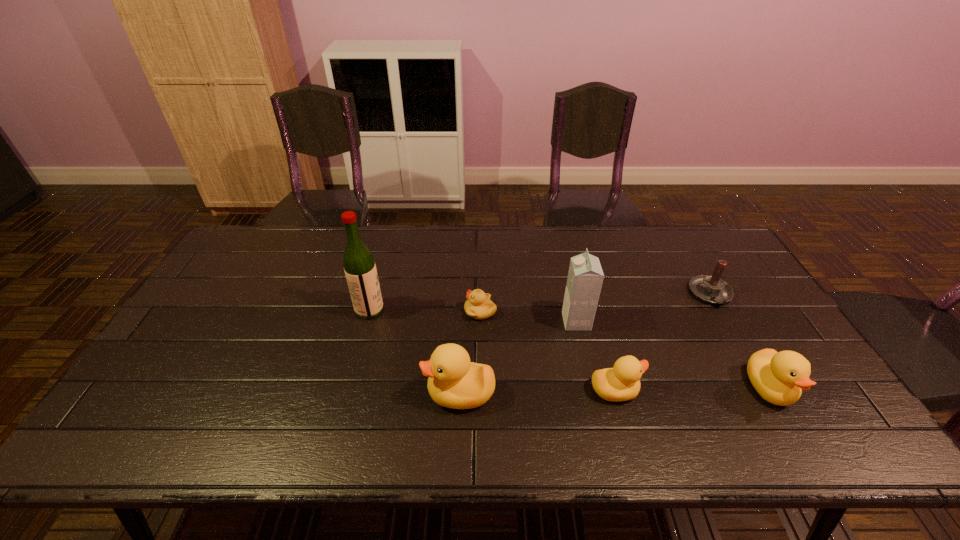
Image resolution: width=960 pixels, height=540 pixels. I want to click on vacant space situated 0.160m on the side of the candle with the handle loop, so click(x=744, y=354).

Where is `vacant space located on the front label of the second tallest object`? This screenshot has width=960, height=540. vacant space located on the front label of the second tallest object is located at coordinates (453, 321).

Locate an element on the screen. free space located 0.300m on the front label of the second tallest object is located at coordinates (460, 321).

At what (x,y) coordinates should I click in order to perform the action: click on vacant space located 0.310m on the front label of the second tallest object. Please return your answer as a coordinate pair (x, y). This screenshot has width=960, height=540. Looking at the image, I should click on (456, 321).

Locate an element on the screen. vacant space located on the front-facing side of the farthest duckling is located at coordinates (370, 311).

The image size is (960, 540). Identify the location of blank area located 0.400m on the front-facing side of the farthest duckling. (329, 311).

Identify the location of vacant space situated on the front-facing side of the farthest duckling. (343, 311).

This screenshot has height=540, width=960. I want to click on duckling positioned at the right edge, so click(779, 377).

I want to click on candle at the right edge, so click(x=711, y=289).

Where is `object located in the near right corner section of the desktop`? This screenshot has width=960, height=540. object located in the near right corner section of the desktop is located at coordinates (779, 377).